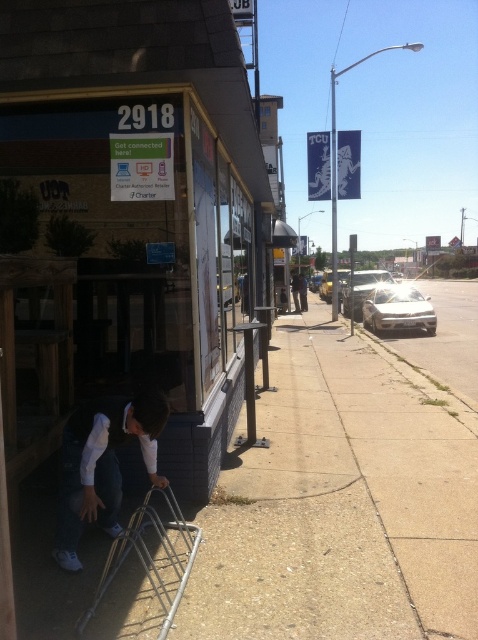
Question: Observing the image, what is the correct spatial positioning of white matte squat at lower left in reference to white matte car at right?

Choices:
 (A) left
 (B) right

Answer: (A)

Question: Can you confirm if white matte squat at lower left is positioned to the right of white matte car at right?

Choices:
 (A) yes
 (B) no

Answer: (B)

Question: Where is white matte squat at lower left located in relation to white matte car at right in the image?

Choices:
 (A) right
 (B) left

Answer: (B)